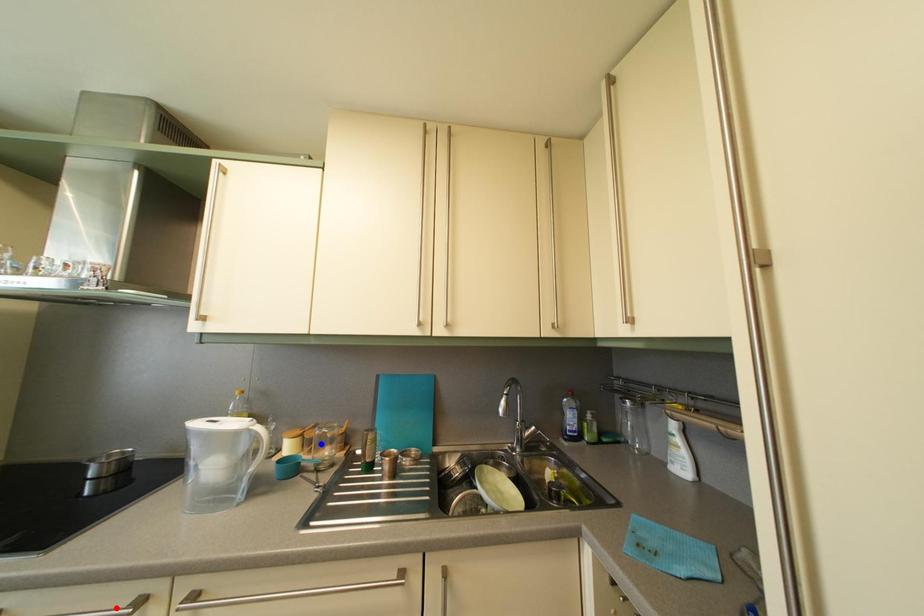
Question: Two points are marked on the image. Which point is closer to the camera?

Choices:
 (A) Blue point is closer.
 (B) Red point is closer.

Answer: (B)